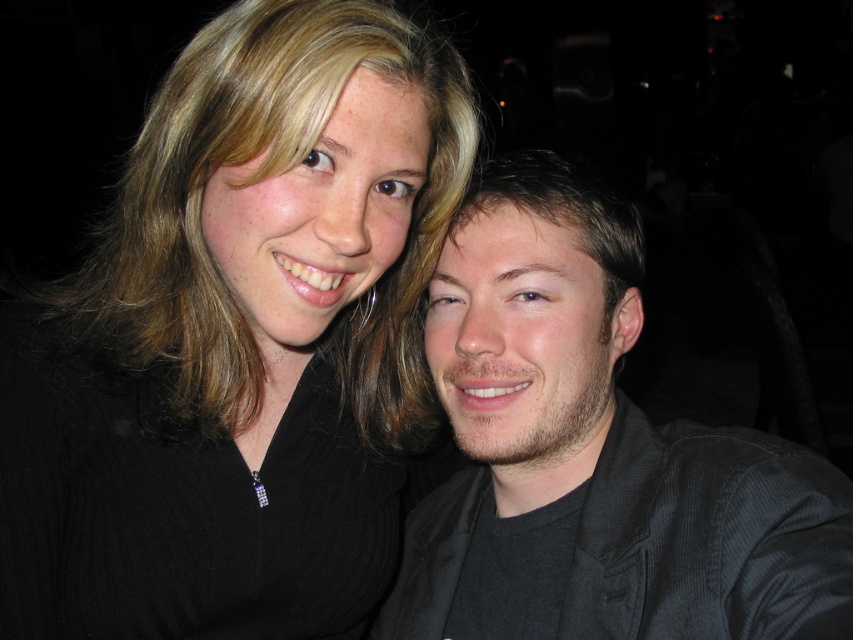
You are a photographer using a camera with a 50mm lens. The minimum focusing distance for this lens is 45 centimeters. You are trying to capture a closeup of the matte black hair at upper left. Is the current distance sufficient for the camera to focus properly?

The matte black hair at upper left is 63.33 centimeters away from the camera, which is beyond the minimum focusing distance of 45 centimeters. Therefore, the camera can focus on the matte black hair at upper left without any issues.

You are a photographer adjusting the camera settings for a portrait. You notice the matte black hair at upper left and the dark gray textured shirt at right in the frame. Which object should you focus on first if you want to ensure the subject with the taller feature is sharp?

The matte black hair at upper left is taller than the dark gray textured shirt at right, so you should focus on the matte black hair at upper left first to ensure it is sharp.

You are a photographer trying to frame a portrait. You have two elements in your viewfinder, the matte black hair at upper left and the dark gray textured shirt at right. Which element is wider in the frame?

The matte black hair at upper left is wider in the frame than the dark gray textured shirt at right.